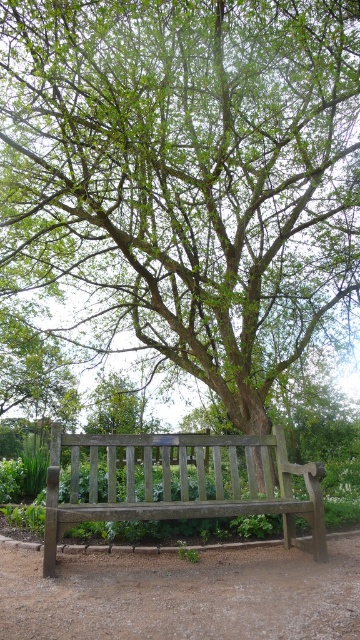
Question: Does dirt path at lower center appear on the right side of wooden bench at center?

Choices:
 (A) yes
 (B) no

Answer: (B)

Question: Is dirt path at lower center further to camera compared to wooden bench at center?

Choices:
 (A) yes
 (B) no

Answer: (B)

Question: Is dirt path at lower center thinner than wooden bench at center?

Choices:
 (A) yes
 (B) no

Answer: (B)

Question: Which of the following is the closest to the observer?

Choices:
 (A) wooden bench at center
 (B) dirt path at lower center

Answer: (B)